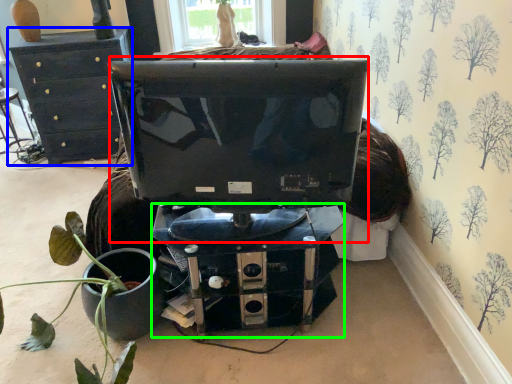
Question: Which object is positioned farthest from computer monitor (highlighted by a red box)? Select from furniture (highlighted by a blue box) and computer desk (highlighted by a green box).

Choices:
 (A) furniture
 (B) computer desk

Answer: (A)